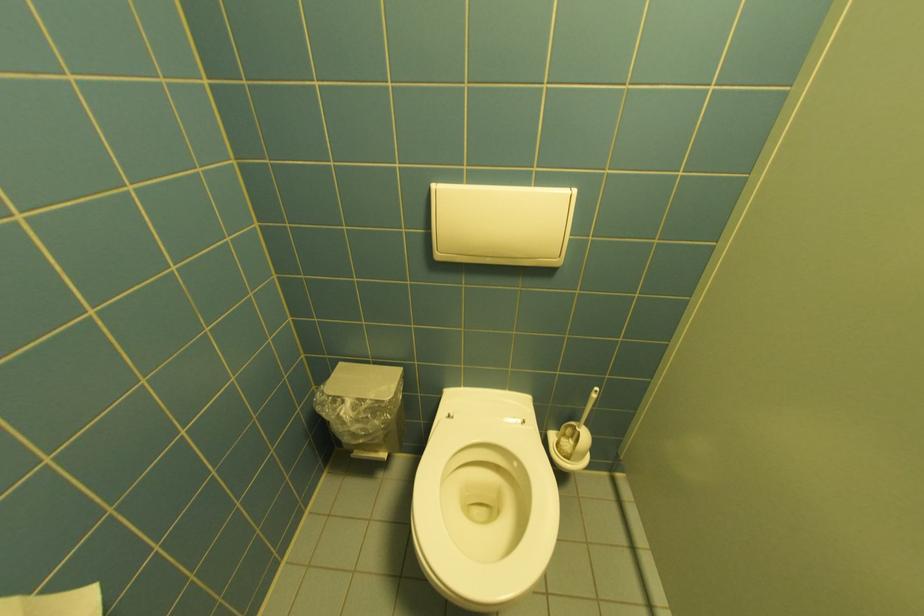
Identify the location of bin lid. (362, 381).